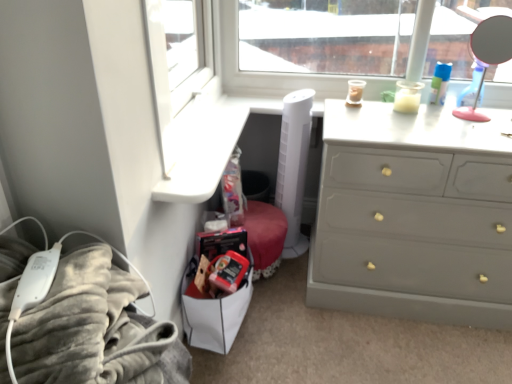
Question: Considering the relative positions of matte gray dresser at right and velvety gray blanket at lower left in the image provided, is matte gray dresser at right to the right of velvety gray blanket at lower left from the viewer's perspective?

Choices:
 (A) no
 (B) yes

Answer: (B)

Question: Is matte gray dresser at right wider than velvety gray blanket at lower left?

Choices:
 (A) no
 (B) yes

Answer: (B)

Question: From the image's perspective, does matte gray dresser at right appear lower than velvety gray blanket at lower left?

Choices:
 (A) yes
 (B) no

Answer: (B)

Question: From a real-world perspective, is matte gray dresser at right under velvety gray blanket at lower left?

Choices:
 (A) no
 (B) yes

Answer: (B)

Question: Is matte gray dresser at right looking in the opposite direction of velvety gray blanket at lower left?

Choices:
 (A) no
 (B) yes

Answer: (A)

Question: From a real-world perspective, is matte gray dresser at right over velvety gray blanket at lower left?

Choices:
 (A) yes
 (B) no

Answer: (B)

Question: Is matte gray dresser at right next to polished silver mirror at upper right and touching it?

Choices:
 (A) no
 (B) yes

Answer: (A)

Question: Can you confirm if matte gray dresser at right is wider than polished silver mirror at upper right?

Choices:
 (A) yes
 (B) no

Answer: (A)

Question: Considering the relative sizes of matte gray dresser at right and polished silver mirror at upper right in the image provided, is matte gray dresser at right taller than polished silver mirror at upper right?

Choices:
 (A) no
 (B) yes

Answer: (B)

Question: Is matte gray dresser at right smaller than polished silver mirror at upper right?

Choices:
 (A) yes
 (B) no

Answer: (B)

Question: Is matte gray dresser at right shorter than polished silver mirror at upper right?

Choices:
 (A) yes
 (B) no

Answer: (B)

Question: From the image's perspective, would you say matte gray dresser at right is positioned over polished silver mirror at upper right?

Choices:
 (A) no
 (B) yes

Answer: (A)

Question: Is the depth of polished silver mirror at upper right greater than that of velvety gray blanket at lower left?

Choices:
 (A) yes
 (B) no

Answer: (A)